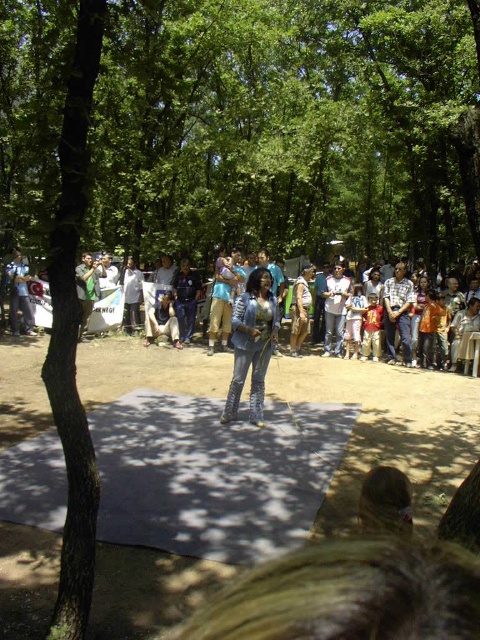
From the picture: Does jeans at center have a lesser height compared to denim jeans at center?

No.

Is point (214, 326) closer to viewer compared to point (164, 332)?

Yes, point (214, 326) is closer to viewer.

At what (x,y) coordinates should I click in order to perform the action: click on jeans at center. Please return your answer as a coordinate pair (x, y). Image resolution: width=480 pixels, height=640 pixels. Looking at the image, I should click on (106, 310).

Does denim jacket at center lie behind jeans at center?

No, denim jacket at center is closer to the viewer.

Identify the location of denim jacket at center. (252, 342).

Does denim jacket at center appear over denim jeans at center?

Actually, denim jacket at center is below denim jeans at center.

Is point (240, 369) farther from camera compared to point (152, 337)?

That is False.

This screenshot has width=480, height=640. In order to click on denim jacket at center in this screenshot , I will do `click(252, 342)`.